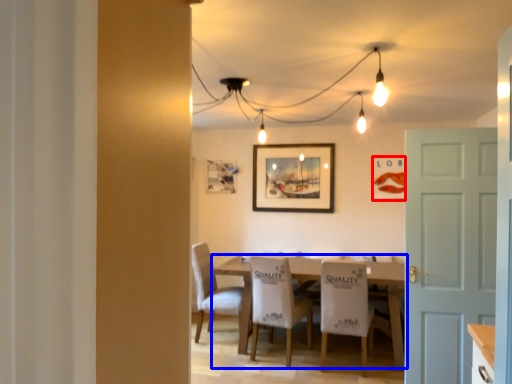
Question: Which object is further to the camera taking this photo, picture frame (highlighted by a red box) or table (highlighted by a blue box)?

Choices:
 (A) picture frame
 (B) table

Answer: (A)